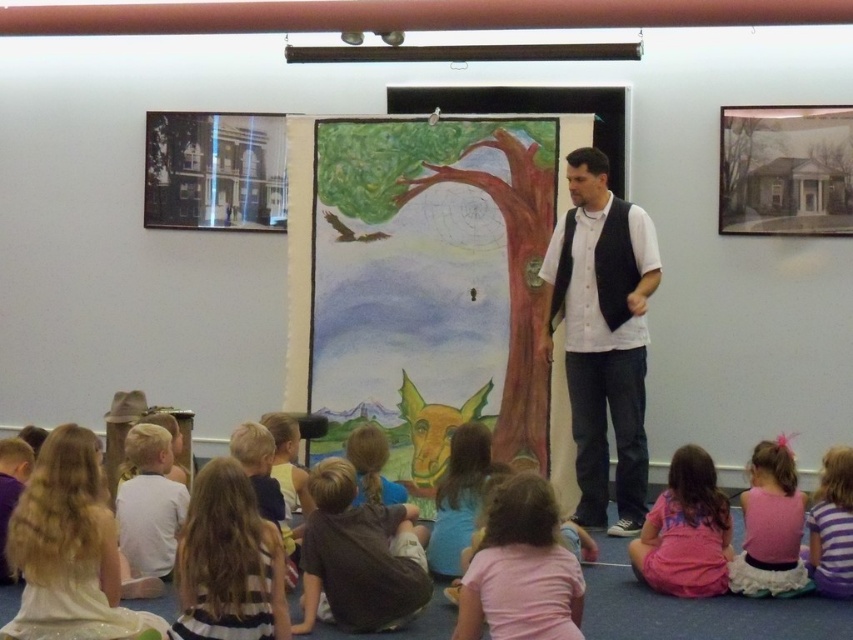
In the classroom scene, there are two children wearing a shiny white dress at lower left and a striped cotton shirt at lower right. Which child is sitting on the left side of the other?

The shiny white dress at lower left is sitting to the left of the striped cotton shirt at lower right, so the child in the shiny white dress at lower left is on the left side of the child in the striped cotton shirt at lower right.

You are a tailor who needs to know which clothing item has a larger width to decide which requires more fabric. You see the brown cotton shirt at lower center and the striped fabric dress at lower left. Which one has a greater width?

The brown cotton shirt at lower center has a greater width than the striped fabric dress at lower left according to the description.

You are a photographer in the classroom and want to capture a photo of the shiny white dress at lower left and the striped fabric dress at lower left. Which dress is more to the left?

The shiny white dress at lower left is more to the left side of the striped fabric dress at lower left.